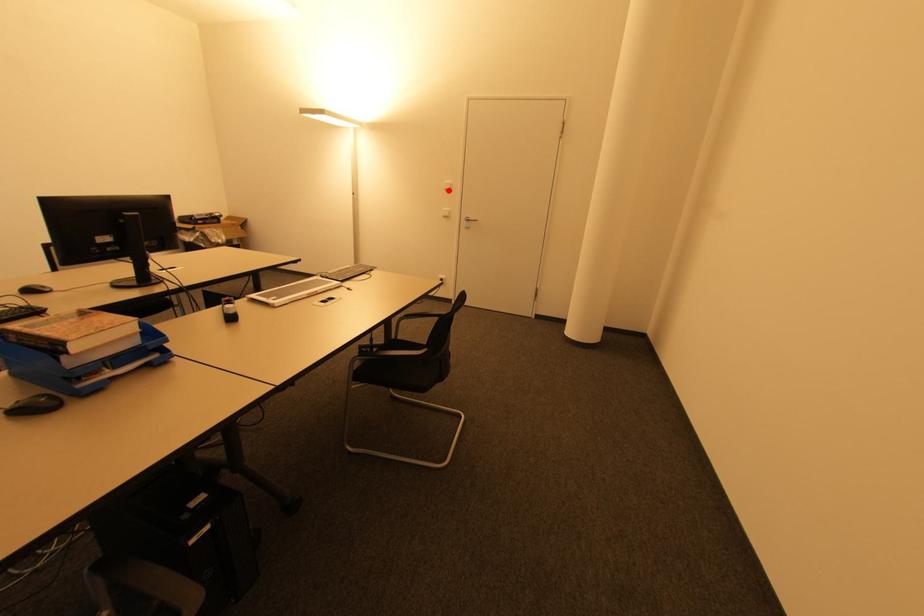
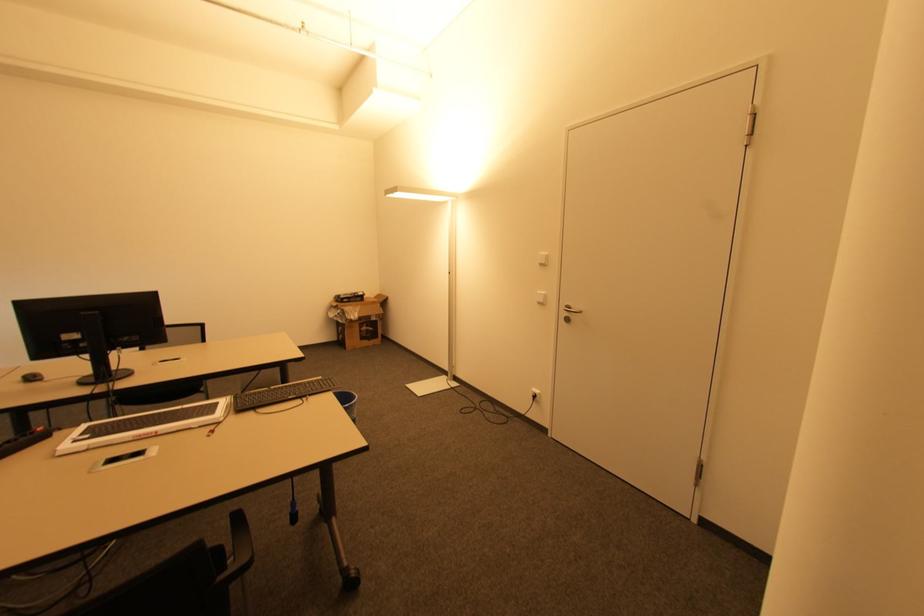
Locate, in the second image, the point that corresponds to the highlighted location in the first image.

(542, 265)